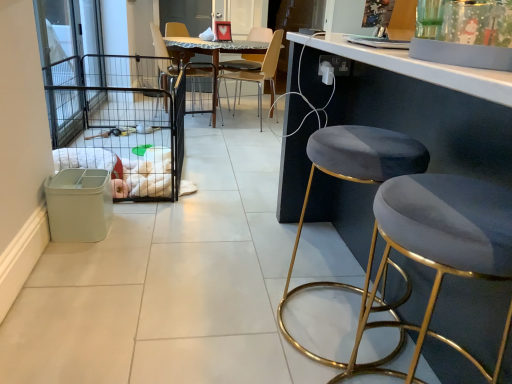
Identify the location of empty space that is in between velvet/golden stool at right, positioned as the second stool in front-to-back order, and metallic brown chair at upper center, which ranks as the first chair in left-to-right order. (236, 185).